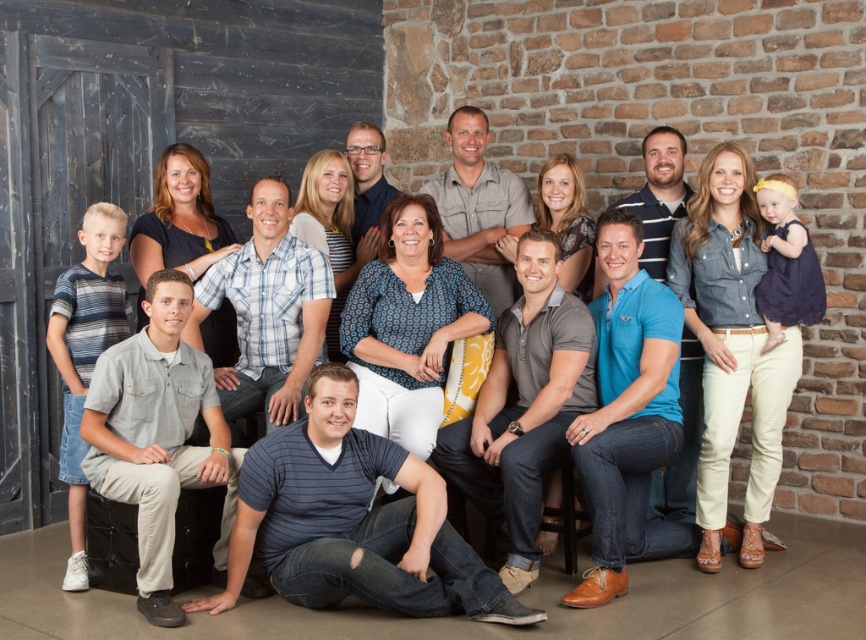
Question: Is striped cotton shirt at center bigger than blue striped shirt at center?

Choices:
 (A) yes
 (B) no

Answer: (B)

Question: Which point appears closest to the camera in this image?

Choices:
 (A) (653, 520)
 (B) (506, 605)

Answer: (B)

Question: Which of the following is the farthest from the observer?

Choices:
 (A) (406, 356)
 (B) (298, 520)

Answer: (A)

Question: Where is striped cotton shirt at center located in relation to blue striped shirt at center in the image?

Choices:
 (A) right
 (B) left

Answer: (B)

Question: Can you confirm if striped cotton shirt at center is smaller than blue striped shirt at center?

Choices:
 (A) no
 (B) yes

Answer: (B)